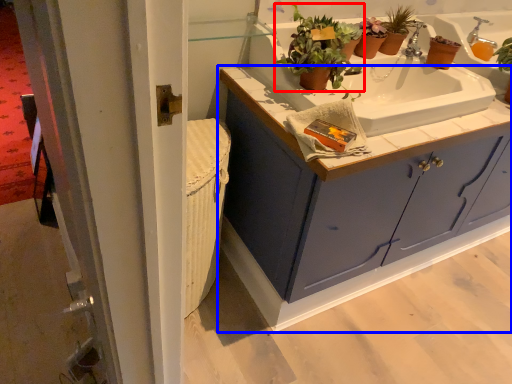
Question: Which object is further to the camera taking this photo, houseplant (highlighted by a red box) or bathroom cabinet (highlighted by a blue box)?

Choices:
 (A) houseplant
 (B) bathroom cabinet

Answer: (A)